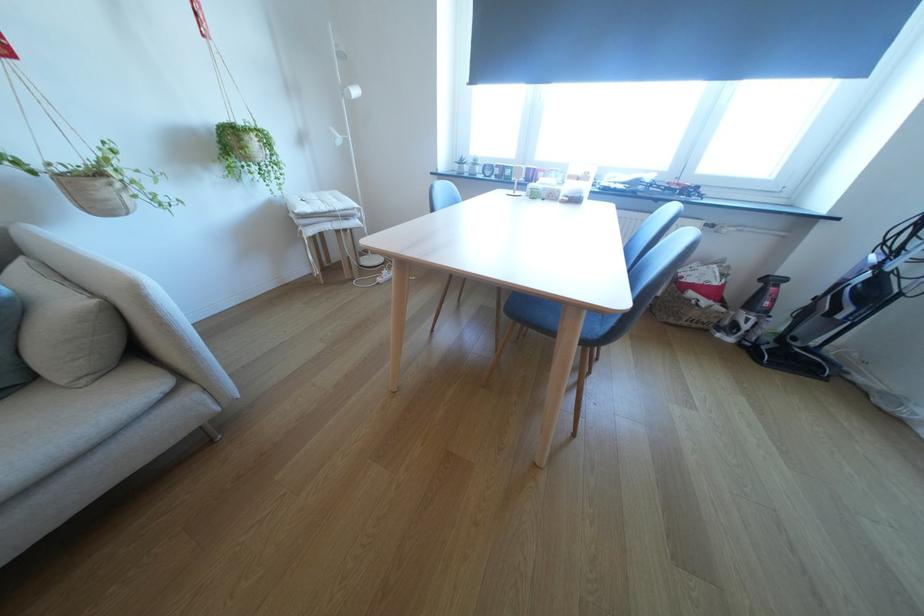
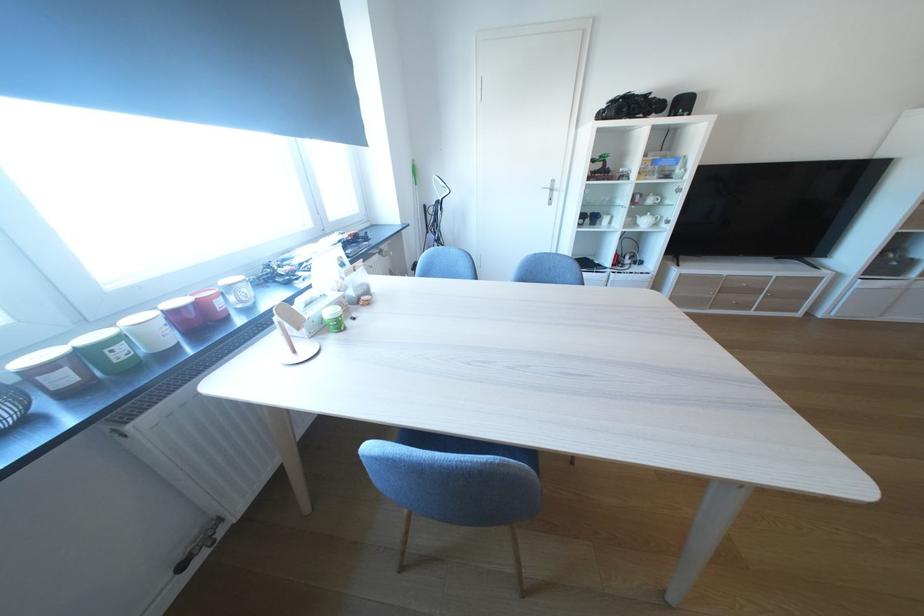
Where in the second image is the point corresponding to (x=518, y=174) from the first image?

(129, 354)